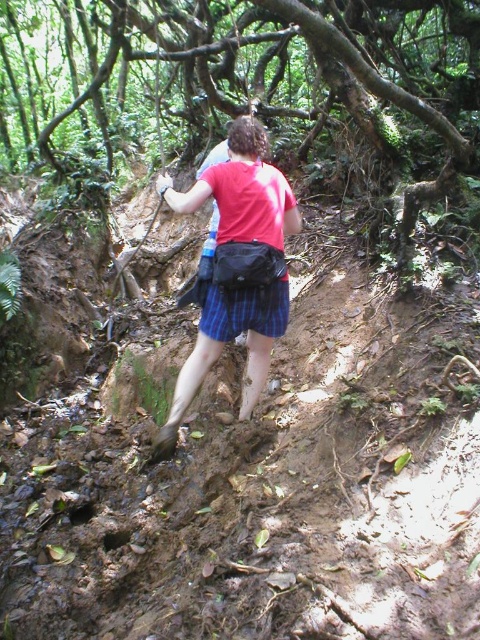
You are a hiker who has just arrived at a muddy trail. You notice a matte red shirt at center and a blue striped kilt at center. Which clothing item is located more to the left?

The matte red shirt at center is positioned on the left side of blue striped kilt at center, so the matte red shirt at center is more to the left.

You are a hiker who just arrived at the trailhead and see the person in the image wearing a matte red shirt at center and a blue striped kilt at center. Which clothing item is higher on their body?

The matte red shirt at center is located above the blue striped kilt at center, so the matte red shirt at center is higher on their body.

You are a hiker who wants to ensure your clothing items are not too close to each other to avoid mud splashes. Given that the distance between the matte red shirt at center and the blue striped kilt at center is 10.77 centimeters, is this distance sufficient to prevent mud from splashing from one to the other?

The distance between the matte red shirt at center and the blue striped kilt at center is 10.77 centimeters. This distance may be sufficient to reduce mud splashing between them, but it ultimately depends on the force and direction of the splashes. However, based on the provided information, the separation exists.